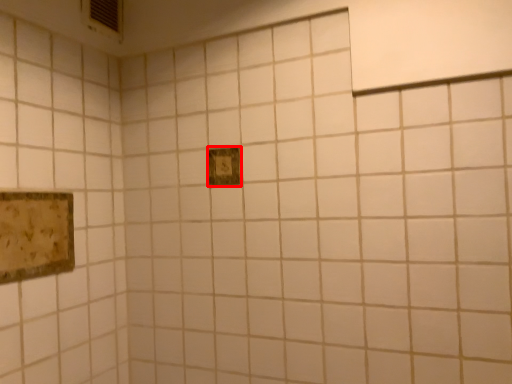
Question: In this image, where is picture frame (annotated by the red box) located relative to picture frame?

Choices:
 (A) left
 (B) right

Answer: (B)